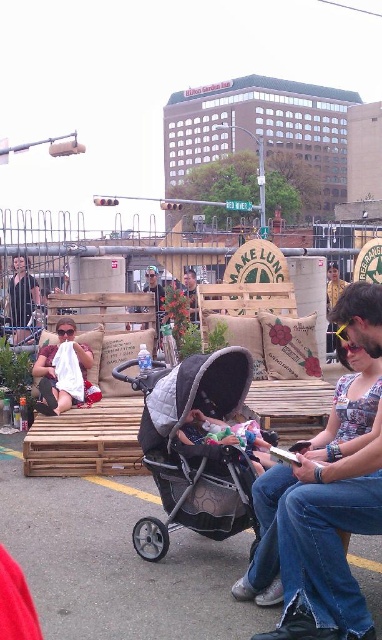
You are a street performer preparing to set up your equipment. You have a large drum that requires a surface area larger than the soft pink fabric at center. Can you place it on the black quilted fabric stroller at center?

The black quilted fabric stroller at center is bigger than the soft pink fabric at center, so yes, the drum can be placed on the black quilted fabric stroller at center since it has a larger surface area.